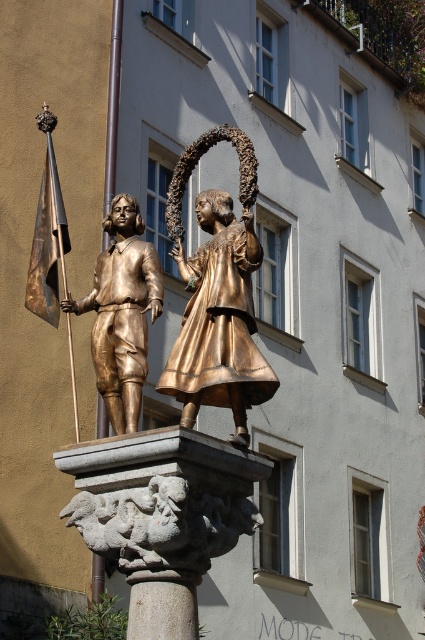
Question: Which of the following is the closest to the observer?

Choices:
 (A) stone column at center
 (B) gold-bronze girl at center
 (C) bronze statue at left

Answer: (A)

Question: Can you confirm if bronze statue at left is wider than stone column at center?

Choices:
 (A) no
 (B) yes

Answer: (B)

Question: Among these points, which one is farthest from the camera?

Choices:
 (A) (139, 589)
 (B) (187, 353)

Answer: (B)

Question: Is bronze statue at left positioned in front of stone column at center?

Choices:
 (A) no
 (B) yes

Answer: (A)

Question: Which point is closer to the camera?

Choices:
 (A) bronze statue at left
 (B) gold-bronze girl at center

Answer: (B)

Question: In this image, where is gold-bronze girl at center located relative to stone column at center?

Choices:
 (A) below
 (B) above

Answer: (B)